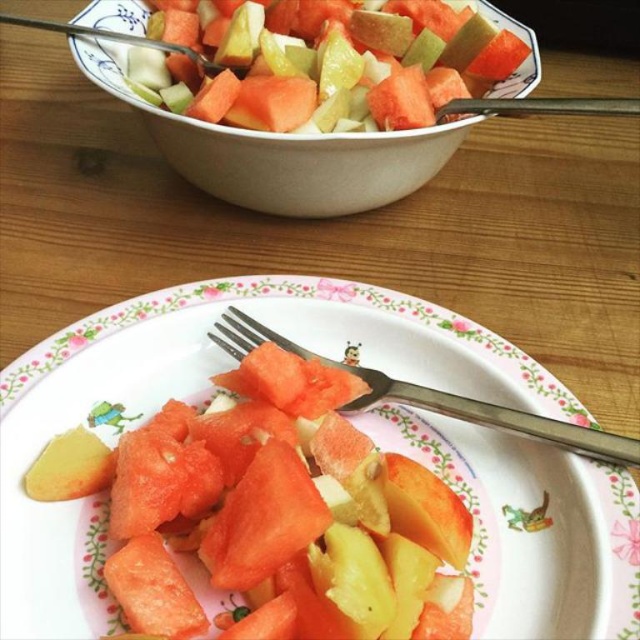
Question: Which is nearer to the white ceramic bowl at upper center?

Choices:
 (A) silver metallic fork at center
 (B) smooth plastic plate at center
 (C) yellow matte potato at lower left

Answer: (B)

Question: Is silver metallic fork at center below yellow matte potato at lower left?

Choices:
 (A) yes
 (B) no

Answer: (B)

Question: Which of these objects is positioned farthest from the silver metallic fork at center?

Choices:
 (A) smooth plastic plate at center
 (B) white ceramic bowl at upper center

Answer: (B)

Question: Does white ceramic bowl at upper center lie in front of yellow matte potato at lower left?

Choices:
 (A) no
 (B) yes

Answer: (A)

Question: From the image, what is the correct spatial relationship of smooth plastic plate at center in relation to yellow matte potato at lower left?

Choices:
 (A) left
 (B) right

Answer: (B)

Question: Which point is closer to the camera?

Choices:
 (A) (561, 442)
 (B) (38, 493)

Answer: (B)